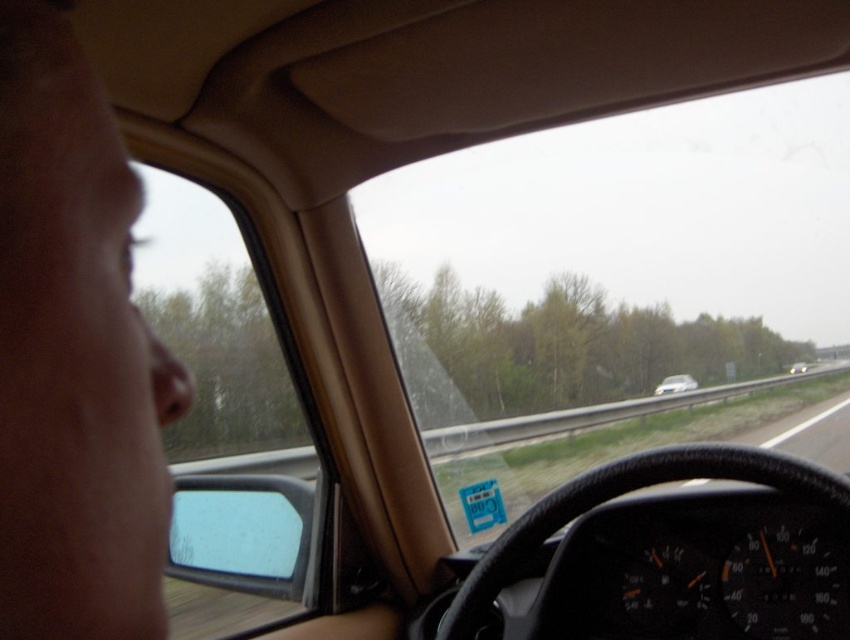
Does point (605, 308) come farther from viewer compared to point (683, 374)?

Yes.

Is point (545, 380) closer to camera compared to point (677, 378)?

Yes, point (545, 380) is closer to viewer.

Who is more distant from viewer, (557, 304) or (697, 385)?

The point (697, 385) is more distant.

Locate an element on the screen. The image size is (850, 640). transparent glass windshield at upper center is located at coordinates (609, 276).

Does transparent glass windshield at upper center appear under transparent glass windshield at upper left?

Incorrect, transparent glass windshield at upper center is not positioned below transparent glass windshield at upper left.

Is transparent glass windshield at upper center smaller than transparent glass windshield at upper left?

No, transparent glass windshield at upper center is not smaller than transparent glass windshield at upper left.

This screenshot has width=850, height=640. Identify the location of transparent glass windshield at upper center. (609, 276).

Find the location of `transparent glass windshield at upper center`. transparent glass windshield at upper center is located at coordinates (609, 276).

Is transparent glass windshield at upper left taller than white glossy sedan at center?

Yes.

Does point (256, 314) come farther from viewer compared to point (805, 369)?

No.

Locate an element on the screen. Image resolution: width=850 pixels, height=640 pixels. transparent glass windshield at upper left is located at coordinates (216, 333).

Where is `transparent glass windshield at upper left`? transparent glass windshield at upper left is located at coordinates (216, 333).